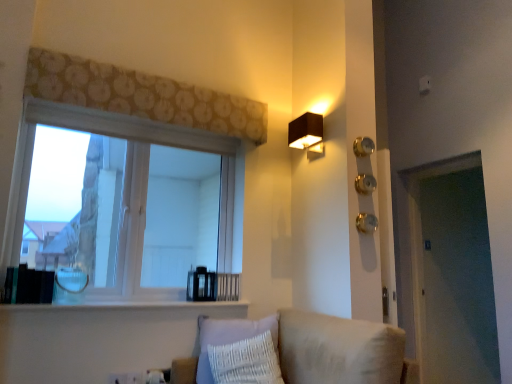
Question: Based on their sizes in the image, would you say white plastic electric outlet at lower left, which is counted as the first electric outlet, starting from the left, is bigger or smaller than gold metallic knob at right, which is the second knob in bottom-to-top order?

Choices:
 (A) small
 (B) big

Answer: (A)

Question: From a real-world perspective, is white plastic electric outlet at lower left, which is counted as the first electric outlet, starting from the left, above or below gold metallic knob at right, the second knob in the top-to-bottom sequence?

Choices:
 (A) above
 (B) below

Answer: (B)

Question: Estimate the real-world distances between objects in this image. Which object is closer to the black matte rectangular lamp at upper right?

Choices:
 (A) patterned fabric curtain at upper center
 (B) white plastic electric outlet at lower center, the first electric outlet positioned from the right
 (C) white glossy window sill at lower center
 (D) gold metallic knob at right, the second knob in the top-to-bottom sequence
 (E) beige fabric couch at lower center

Answer: (D)

Question: Which object is the farthest from the patterned fabric curtain at upper center?

Choices:
 (A) white wood window at upper left
 (B) white glossy window sill at lower center
 (C) gold metallic knob at right, which is the third knob in bottom-to-top order
 (D) white plastic electric outlet at lower center, which ranks as the second electric outlet in left-to-right order
 (E) black matte rectangular lamp at upper right

Answer: (D)